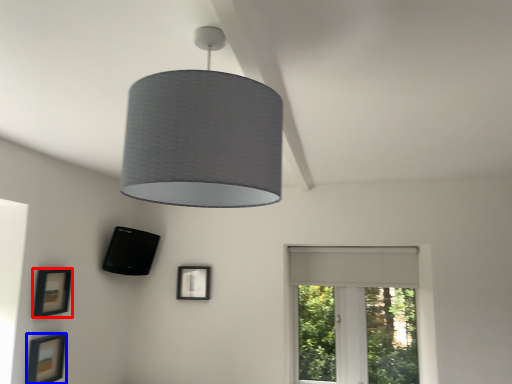
Question: Among these objects, which one is nearest to the camera, picture frame (highlighted by a red box) or picture frame (highlighted by a blue box)?

Choices:
 (A) picture frame
 (B) picture frame

Answer: (B)